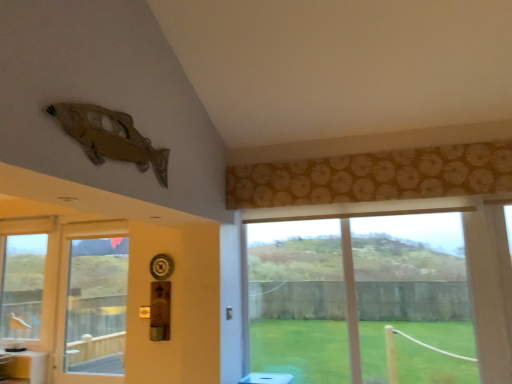
Question: Is matte brown curtain at upper center oriented away from metallic brass door handle at lower center?

Choices:
 (A) no
 (B) yes

Answer: (A)

Question: Would you consider matte brown curtain at upper center to be distant from metallic brass door handle at lower center?

Choices:
 (A) no
 (B) yes

Answer: (A)

Question: Considering the relative sizes of matte brown curtain at upper center and metallic brass door handle at lower center in the image provided, is matte brown curtain at upper center thinner than metallic brass door handle at lower center?

Choices:
 (A) no
 (B) yes

Answer: (A)

Question: Considering the relative positions of matte brown curtain at upper center and metallic brass door handle at lower center in the image provided, is matte brown curtain at upper center in front of metallic brass door handle at lower center?

Choices:
 (A) yes
 (B) no

Answer: (A)

Question: Is matte brown curtain at upper center bigger than metallic brass door handle at lower center?

Choices:
 (A) yes
 (B) no

Answer: (A)

Question: Do you think metallic brass door handle at lower center is within white glossy counter top at lower left, or outside of it?

Choices:
 (A) inside
 (B) outside

Answer: (B)

Question: Relative to white glossy counter top at lower left, is metallic brass door handle at lower center in front or behind?

Choices:
 (A) behind
 (B) front

Answer: (B)

Question: Considering the positions of metallic brass door handle at lower center and white glossy counter top at lower left in the image, is metallic brass door handle at lower center wider or thinner than white glossy counter top at lower left?

Choices:
 (A) wide
 (B) thin

Answer: (B)

Question: From the image's perspective, relative to white glossy counter top at lower left, is metallic brass door handle at lower center above or below?

Choices:
 (A) below
 (B) above

Answer: (B)

Question: Does point (31, 355) appear closer or farther from the camera than point (228, 317)?

Choices:
 (A) closer
 (B) farther

Answer: (B)

Question: From the image's perspective, is white glossy counter top at lower left above or below metallic brass door handle at lower center?

Choices:
 (A) above
 (B) below

Answer: (B)

Question: Based on their positions, is white glossy counter top at lower left located to the left or right of metallic brass door handle at lower center?

Choices:
 (A) right
 (B) left

Answer: (B)

Question: Considering the positions of white glossy counter top at lower left and metallic brass door handle at lower center in the image, is white glossy counter top at lower left taller or shorter than metallic brass door handle at lower center?

Choices:
 (A) tall
 (B) short

Answer: (B)

Question: Is point (69, 327) positioned closer to the camera than point (397, 286)?

Choices:
 (A) farther
 (B) closer

Answer: (A)

Question: In terms of size, does transparent glass door at left appear bigger or smaller than matte brown curtain at upper center?

Choices:
 (A) big
 (B) small

Answer: (B)